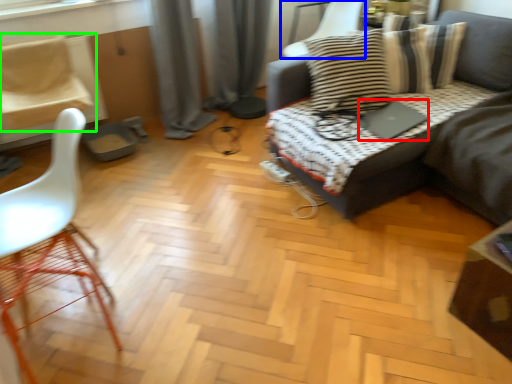
Question: Based on their relative distances, which object is farther from laptop (highlighted by a red box)? Choose from chair (highlighted by a blue box) and chair (highlighted by a green box).

Choices:
 (A) chair
 (B) chair

Answer: (B)